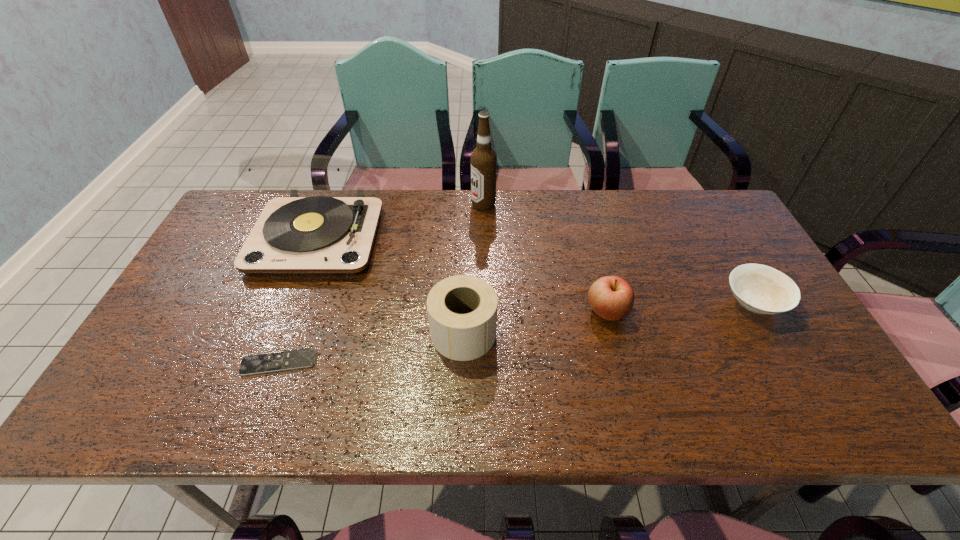
Where is `vacant area that satisfies the following two spatial constraints: 1. with the tonearm facing the front of the record player; 2. on the right side of the shortest object`? The height and width of the screenshot is (540, 960). vacant area that satisfies the following two spatial constraints: 1. with the tonearm facing the front of the record player; 2. on the right side of the shortest object is located at coordinates (270, 362).